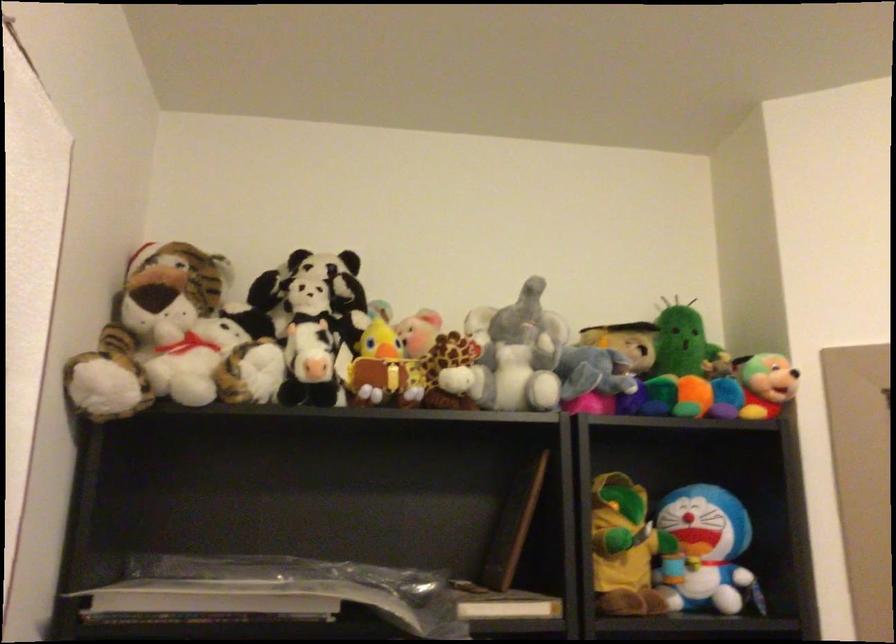
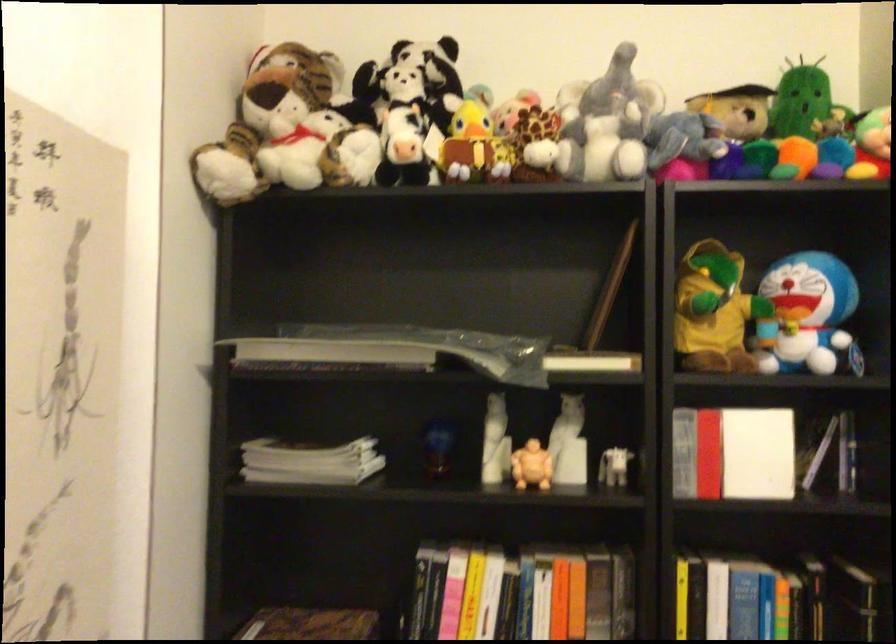
The point at (386, 370) is marked in the first image. Where is the corresponding point in the second image?

(475, 146)